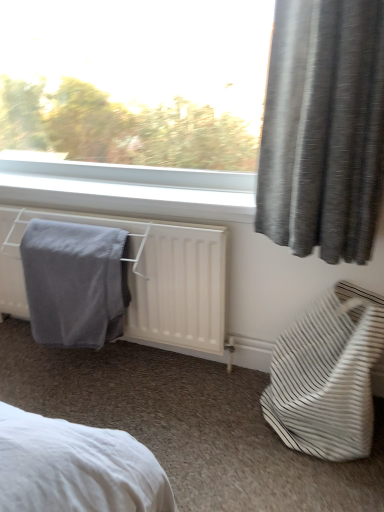
At what (x,y) coordinates should I click in order to perform the action: click on vacant space to the left of white striped fabric bag at lower right. Please return your answer as a coordinate pair (x, y). The image size is (384, 512). Looking at the image, I should click on tap(211, 421).